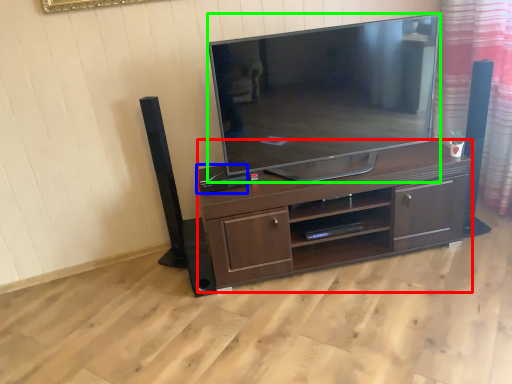
Question: Considering the real-world distances, which object is farthest from desk (highlighted by a red box)? speaker (highlighted by a blue box) or television (highlighted by a green box)?

Choices:
 (A) speaker
 (B) television

Answer: (A)